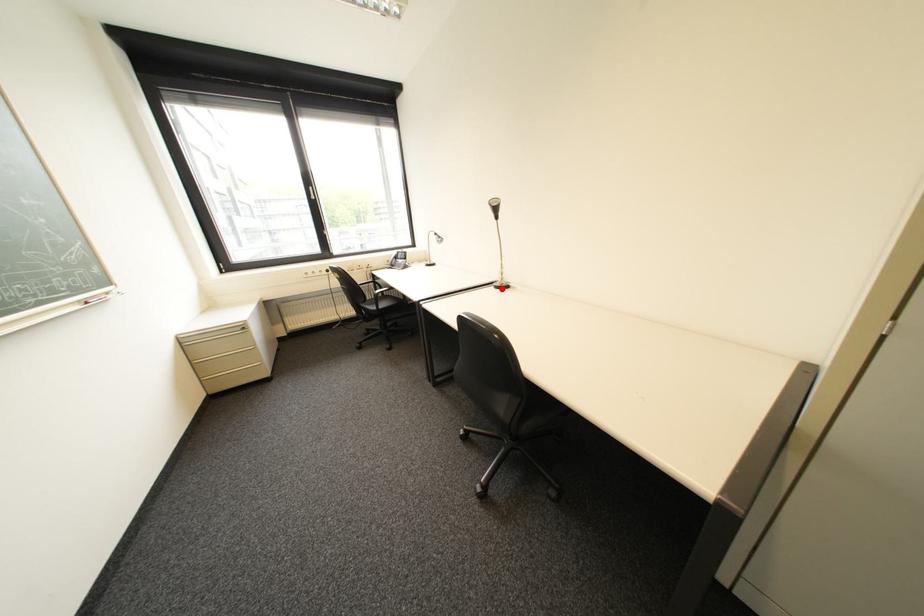
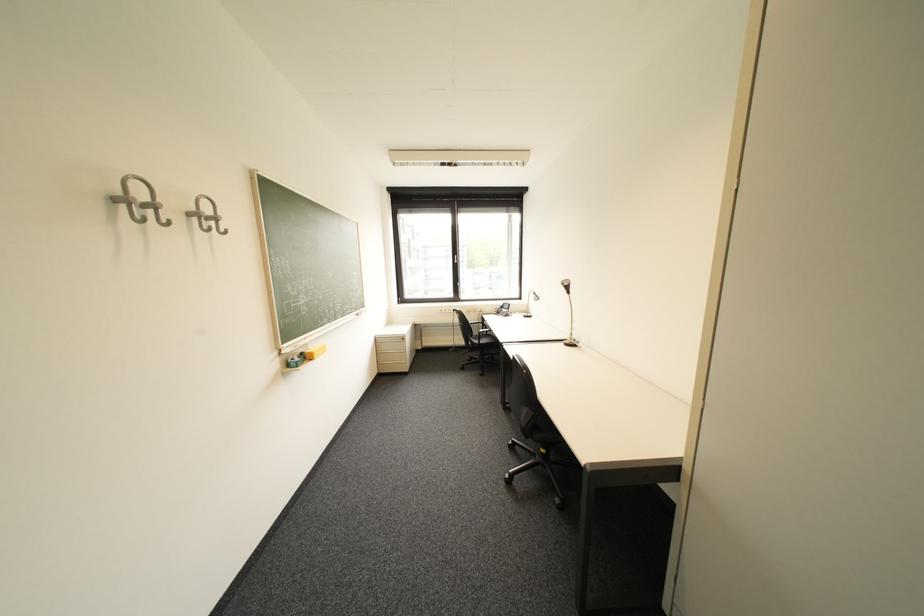
The point at the highlighted location is marked in the first image. Where is the corresponding point in the second image?

(572, 345)